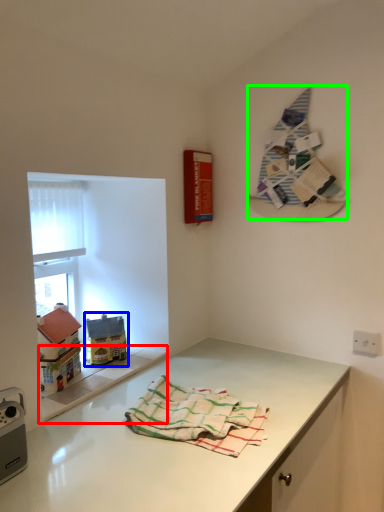
Question: Which object is the closest to the window sill (highlighted by a red box)? Choose among these: toy (highlighted by a blue box) or textile (highlighted by a green box).

Choices:
 (A) toy
 (B) textile

Answer: (A)